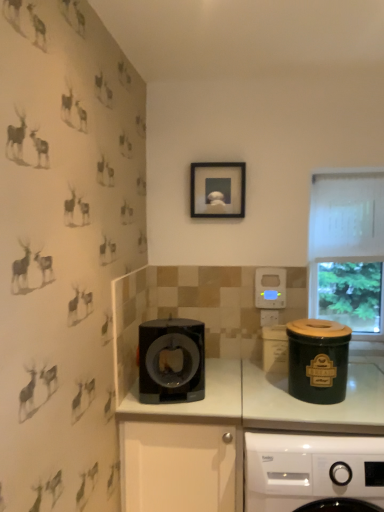
Question: From a real-world perspective, is black matte picture frame at upper center above or below green ceramic canister at right?

Choices:
 (A) above
 (B) below

Answer: (A)

Question: In the image, is black matte picture frame at upper center positioned in front of or behind green ceramic canister at right?

Choices:
 (A) front
 (B) behind

Answer: (B)

Question: Which object is the closest to the black plastic drawer at center?

Choices:
 (A) transparent glass window at upper right
 (B) black glossy coffee maker at center
 (C) green ceramic canister at right
 (D) green ceramic canister at right
 (E) black matte picture frame at upper center

Answer: (B)

Question: Estimate the real-world distances between objects in this image. Which object is farther from the transparent glass window at upper right?

Choices:
 (A) black matte picture frame at upper center
 (B) black plastic drawer at center
 (C) green ceramic canister at right
 (D) green ceramic canister at right
 (E) black glossy coffee maker at center

Answer: (B)